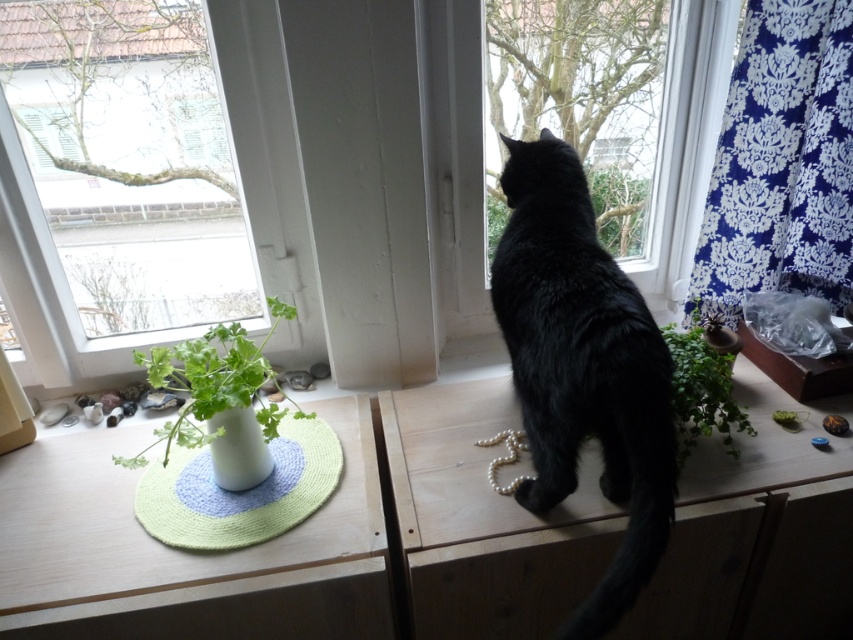
You are organizing a small party and need to place a decorative item on the blue damask fabric at upper right and the white glossy vase at lower left. If you want to place them so that one is closer to guests sitting in front of the window, which object should you choose?

The blue damask fabric at upper right is closer to the guests because it is positioned further to the viewer than the white glossy vase at lower left.

You are organizing a small shelf and need to place both the green knitted mat at lower left and the white glossy vase at center. If the shelf has limited space, which item should you place first to ensure both fit?

The green knitted mat at lower left is bigger than the white glossy vase at center, so you should place the white glossy vase at center first to accommodate the larger mat afterward.

Consider the image. You are a painter standing in the room and want to paint the transparent glass window at upper left and the green leafy plant at center. Which object should you focus on first if you want to paint the taller one first?

The transparent glass window at upper left is much taller than the green leafy plant at center, so you should focus on painting the transparent glass window at upper left first.